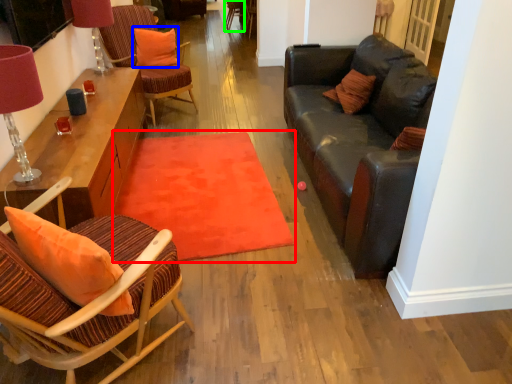
Question: Which object is positioned farthest from mat (highlighted by a red box)? Select from pillow (highlighted by a blue box) and armchair (highlighted by a green box).

Choices:
 (A) pillow
 (B) armchair

Answer: (B)